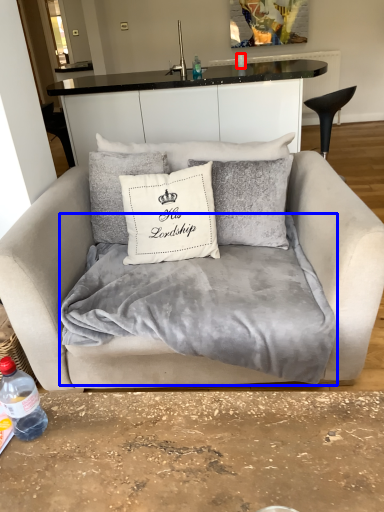
Question: Which of the following is the farthest to the observer, coffee cup (highlighted by a red box) or blanket (highlighted by a blue box)?

Choices:
 (A) coffee cup
 (B) blanket

Answer: (A)